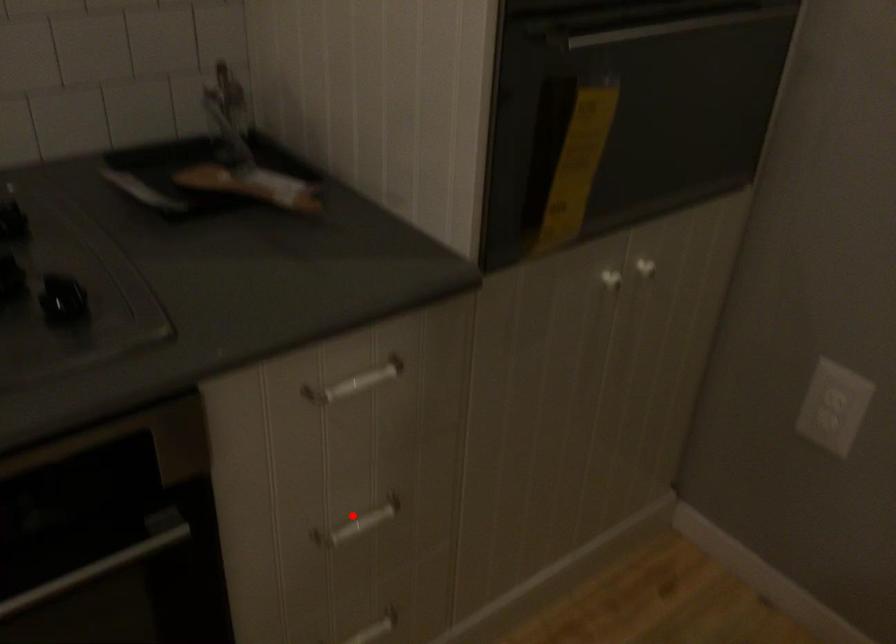
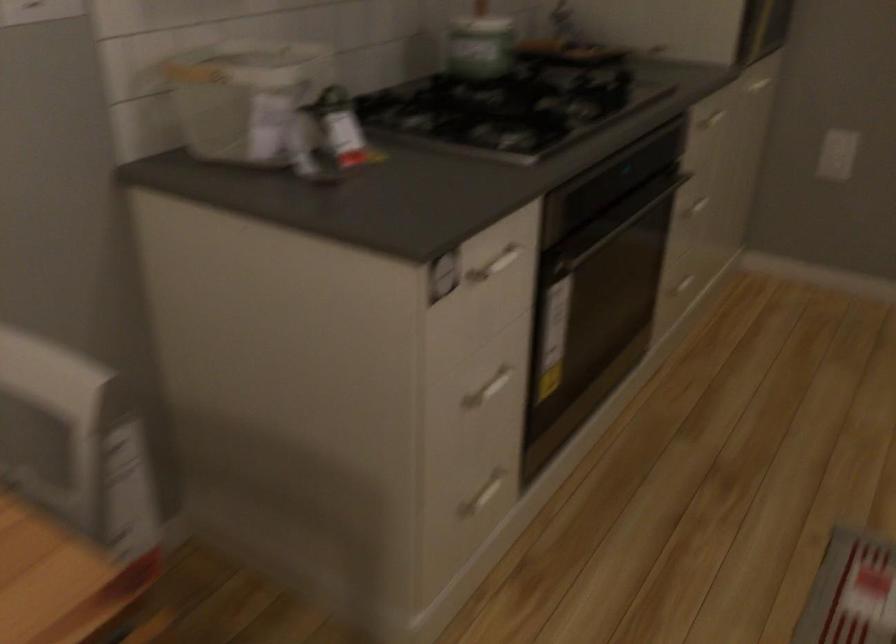
The point at the highlighted location is marked in the first image. Where is the corresponding point in the second image?

(694, 204)